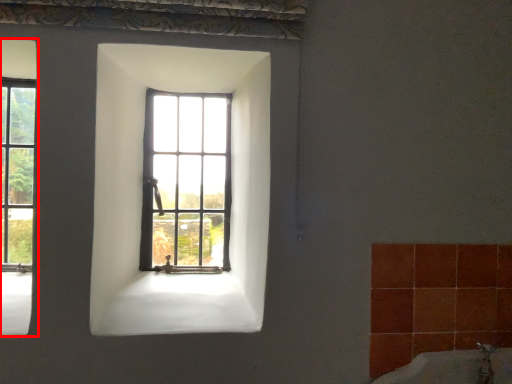
Question: Where is window (annotated by the red box) located in relation to window in the image?

Choices:
 (A) right
 (B) left

Answer: (B)